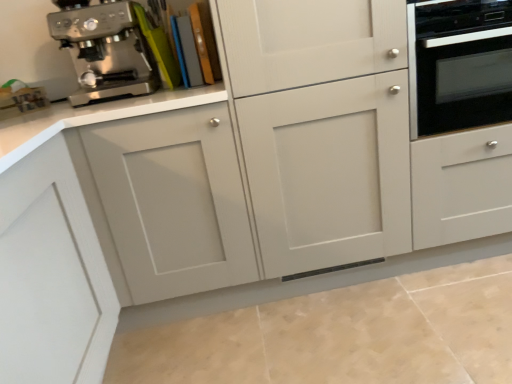
Question: Is point (119, 19) positioned closer to the camera than point (425, 117)?

Choices:
 (A) farther
 (B) closer

Answer: (A)

Question: From a real-world perspective, is stainless steel coffee maker at upper left above or below black glass oven at right?

Choices:
 (A) below
 (B) above

Answer: (B)

Question: Do you think stainless steel coffee maker at upper left is within black glass oven at right, or outside of it?

Choices:
 (A) inside
 (B) outside

Answer: (B)

Question: From a real-world perspective, relative to stainless steel coffee maker at upper left, is black glass oven at right vertically above or below?

Choices:
 (A) below
 (B) above

Answer: (A)

Question: In terms of height, does black glass oven at right look taller or shorter compared to stainless steel coffee maker at upper left?

Choices:
 (A) tall
 (B) short

Answer: (A)

Question: From the image's perspective, relative to stainless steel coffee maker at upper left, is black glass oven at right above or below?

Choices:
 (A) below
 (B) above

Answer: (A)

Question: Does point (481, 115) appear closer or farther from the camera than point (115, 59)?

Choices:
 (A) farther
 (B) closer

Answer: (A)